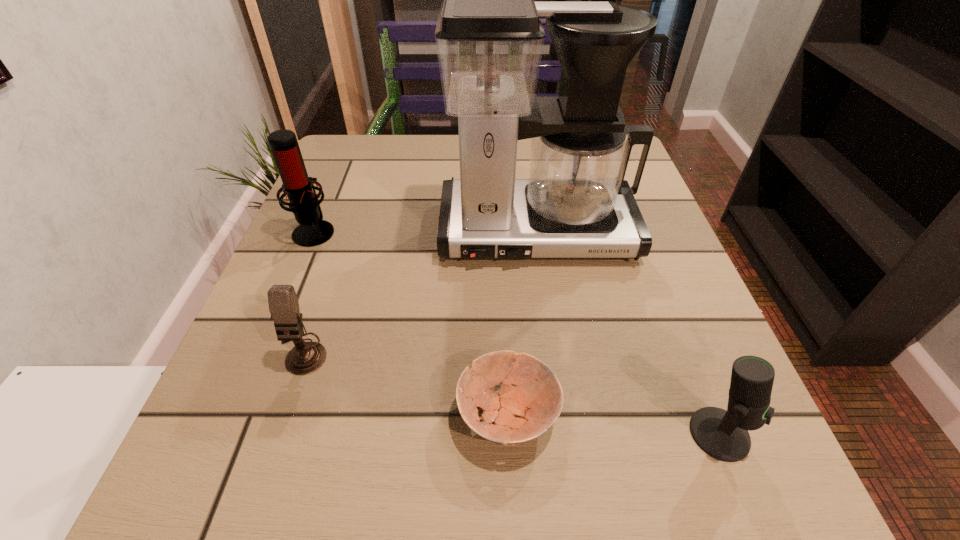
Identify the location of coffee maker. The image size is (960, 540). (575, 203).

Find the location of `the farthest microphone`. the farthest microphone is located at coordinates (313, 230).

At what (x,y) coordinates should I click in order to perform the action: click on the second tallest object. Please return your answer as a coordinate pair (x, y). The image size is (960, 540). Looking at the image, I should click on (313, 230).

Find the location of a particular element. This screenshot has width=960, height=540. the rightmost microphone is located at coordinates (723, 434).

In order to click on the second nearest microphone in this screenshot , I will do `click(304, 358)`.

Find the location of a particular element. The image size is (960, 540). bowl is located at coordinates (521, 413).

At what (x,y) coordinates should I click in order to perform the action: click on blank space located at the front of the coffee maker where the controls are located. Please return your answer as a coordinate pair (x, y). Looking at the image, I should click on (559, 393).

In order to click on vacant area situated on the right of the farthest microphone in this screenshot , I will do `click(404, 231)`.

Where is `vacant region located on the left of the rightmost microphone`? vacant region located on the left of the rightmost microphone is located at coordinates (638, 434).

Where is `vacant region located 0.150m on the front-facing side of the second farthest microphone`? The height and width of the screenshot is (540, 960). vacant region located 0.150m on the front-facing side of the second farthest microphone is located at coordinates (259, 480).